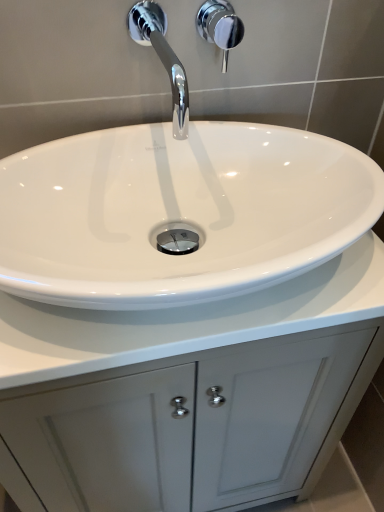
Question: Should I look upward or downward to see white glossy sink at center?

Choices:
 (A) down
 (B) up

Answer: (B)

Question: Considering the relative sizes of chrome metallic shower handle at upper center and white glossy sink at center in the image provided, is chrome metallic shower handle at upper center smaller than white glossy sink at center?

Choices:
 (A) yes
 (B) no

Answer: (A)

Question: Can you confirm if chrome metallic shower handle at upper center is wider than white glossy sink at center?

Choices:
 (A) yes
 (B) no

Answer: (B)

Question: From the image's perspective, is chrome metallic shower handle at upper center on white glossy sink at center?

Choices:
 (A) no
 (B) yes

Answer: (B)

Question: Could you tell me if chrome metallic shower handle at upper center is facing white glossy sink at center?

Choices:
 (A) yes
 (B) no

Answer: (B)

Question: Is chrome metallic shower handle at upper center at the left side of white glossy sink at center?

Choices:
 (A) no
 (B) yes

Answer: (A)

Question: Can you confirm if chrome metallic shower handle at upper center is thinner than white glossy sink at center?

Choices:
 (A) no
 (B) yes

Answer: (B)

Question: Does white glossy sink at center have a lesser width compared to chrome metallic shower handle at upper center?

Choices:
 (A) yes
 (B) no

Answer: (B)

Question: Does white glossy sink at center appear on the left side of chrome metallic shower handle at upper center?

Choices:
 (A) no
 (B) yes

Answer: (B)

Question: Is white glossy sink at center not near chrome metallic shower handle at upper center?

Choices:
 (A) no
 (B) yes

Answer: (A)

Question: Considering the relative sizes of white glossy sink at center and chrome metallic shower handle at upper center in the image provided, is white glossy sink at center taller than chrome metallic shower handle at upper center?

Choices:
 (A) yes
 (B) no

Answer: (A)

Question: Considering the relative positions of white glossy sink at center and chrome metallic shower handle at upper center in the image provided, is white glossy sink at center behind chrome metallic shower handle at upper center?

Choices:
 (A) no
 (B) yes

Answer: (A)

Question: Would you say chrome metallic shower handle at upper center is part of white glossy sink at center's contents?

Choices:
 (A) yes
 (B) no

Answer: (B)

Question: From a real-world perspective, does white glossy cabinet at center sit lower than chrome/metallic faucet at upper center?

Choices:
 (A) yes
 (B) no

Answer: (A)